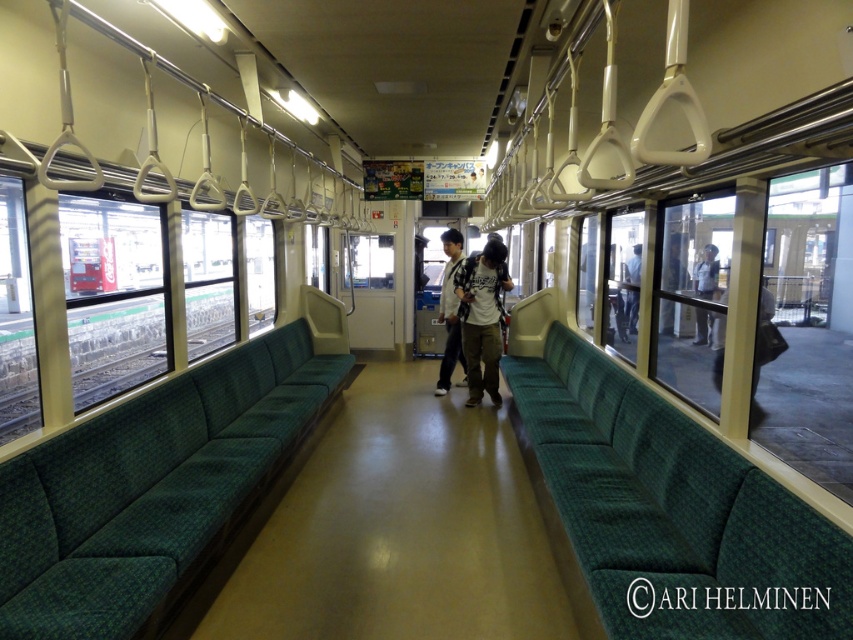
What do you see at coordinates (151, 490) in the screenshot? Image resolution: width=853 pixels, height=640 pixels. I see `green fabric couch at left` at bounding box center [151, 490].

Can you confirm if green fabric couch at left is shorter than white cotton shirt at center?

Indeed, green fabric couch at left has a lesser height compared to white cotton shirt at center.

Is point (22, 604) in front of point (498, 301)?

Yes, point (22, 604) is in front of point (498, 301).

Where is `green fabric couch at left`? This screenshot has width=853, height=640. green fabric couch at left is located at coordinates (151, 490).

Does white cotton shirt at center appear over light gray uniform at center?

No, white cotton shirt at center is not above light gray uniform at center.

Does point (479, 356) come in front of point (701, 282)?

Yes, it is in front of point (701, 282).

What do you see at coordinates (482, 317) in the screenshot? The image size is (853, 640). I see `white cotton shirt at center` at bounding box center [482, 317].

Image resolution: width=853 pixels, height=640 pixels. What are the coordinates of `white cotton shirt at center` in the screenshot? It's located at (482, 317).

Can you confirm if white cotton shirt at center is taller than dark blue jeans at right?

Correct, white cotton shirt at center is much taller as dark blue jeans at right.

What do you see at coordinates (482, 317) in the screenshot? I see `white cotton shirt at center` at bounding box center [482, 317].

You are a GUI agent. You are given a task and a screenshot of the screen. Output one action in this format:
    pyautogui.click(x=<x>, y=<y>)
    Task: Click on the white cotton shirt at center
    The image size is (853, 640).
    Given the screenshot: What is the action you would take?
    pyautogui.click(x=482, y=317)